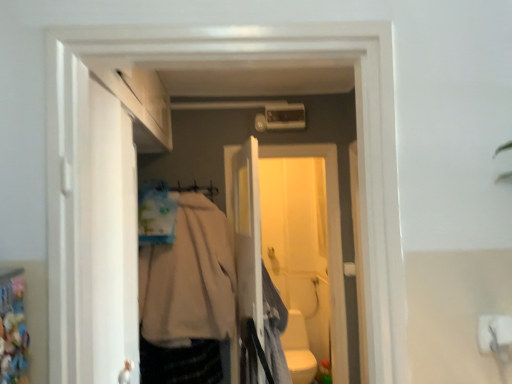
Question: From the image's perspective, is beige fabric coat at center, acting as the first clothing starting from the left, located above white glossy toilet bowl at lower center?

Choices:
 (A) no
 (B) yes

Answer: (B)

Question: From the image's perspective, does beige fabric coat at center, the second clothing in the right-to-left sequence, appear lower than white glossy toilet bowl at lower center?

Choices:
 (A) no
 (B) yes

Answer: (A)

Question: From a real-world perspective, is beige fabric coat at center, acting as the first clothing starting from the left, on top of white glossy toilet bowl at lower center?

Choices:
 (A) yes
 (B) no

Answer: (A)

Question: Considering the relative sizes of beige fabric coat at center, the second clothing in the right-to-left sequence, and white glossy toilet bowl at lower center in the image provided, is beige fabric coat at center, the second clothing in the right-to-left sequence, taller than white glossy toilet bowl at lower center?

Choices:
 (A) no
 (B) yes

Answer: (B)

Question: Can you confirm if beige fabric coat at center, acting as the first clothing starting from the left, is smaller than white glossy toilet bowl at lower center?

Choices:
 (A) no
 (B) yes

Answer: (A)

Question: Is beige fabric coat at center, the second clothing in the right-to-left sequence, to the right of white glossy toilet bowl at lower center from the viewer's perspective?

Choices:
 (A) no
 (B) yes

Answer: (A)

Question: Is beige fabric coat at center, acting as the first clothing starting from the left, in contact with light gray fabric at center, which is the 2th clothing in left-to-right order?

Choices:
 (A) yes
 (B) no

Answer: (B)

Question: Can you confirm if beige fabric coat at center, the second clothing in the right-to-left sequence, is taller than light gray fabric at center, marked as the 1th clothing in a right-to-left arrangement?

Choices:
 (A) no
 (B) yes

Answer: (B)

Question: From the image's perspective, is beige fabric coat at center, the second clothing in the right-to-left sequence, over light gray fabric at center, marked as the 1th clothing in a right-to-left arrangement?

Choices:
 (A) yes
 (B) no

Answer: (A)

Question: Is the depth of beige fabric coat at center, the second clothing in the right-to-left sequence, greater than that of light gray fabric at center, marked as the 1th clothing in a right-to-left arrangement?

Choices:
 (A) yes
 (B) no

Answer: (A)

Question: Is beige fabric coat at center, the second clothing in the right-to-left sequence, far away from light gray fabric at center, which is the 2th clothing in left-to-right order?

Choices:
 (A) no
 (B) yes

Answer: (A)

Question: Does beige fabric coat at center, acting as the first clothing starting from the left, appear on the right side of light gray fabric at center, marked as the 1th clothing in a right-to-left arrangement?

Choices:
 (A) yes
 (B) no

Answer: (B)

Question: Is white plastic screen door at center, which is counted as the first screen door, starting from the front, located within white matte door at left?

Choices:
 (A) no
 (B) yes

Answer: (A)